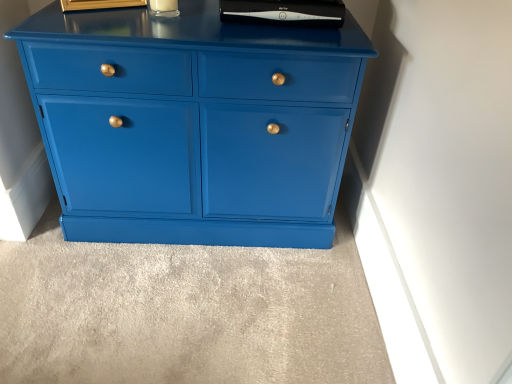
What is the approximate width of matte blue cabinet at center?

It is 18.62 inches.

What do you see at coordinates (193, 124) in the screenshot? This screenshot has width=512, height=384. I see `matte blue cabinet at center` at bounding box center [193, 124].

Where is `matte blue cabinet at center`? The height and width of the screenshot is (384, 512). matte blue cabinet at center is located at coordinates (193, 124).

At what (x,y) coordinates should I click in order to perform the action: click on matte blue cabinet at center. Please return your answer as a coordinate pair (x, y). This screenshot has width=512, height=384. Looking at the image, I should click on (193, 124).